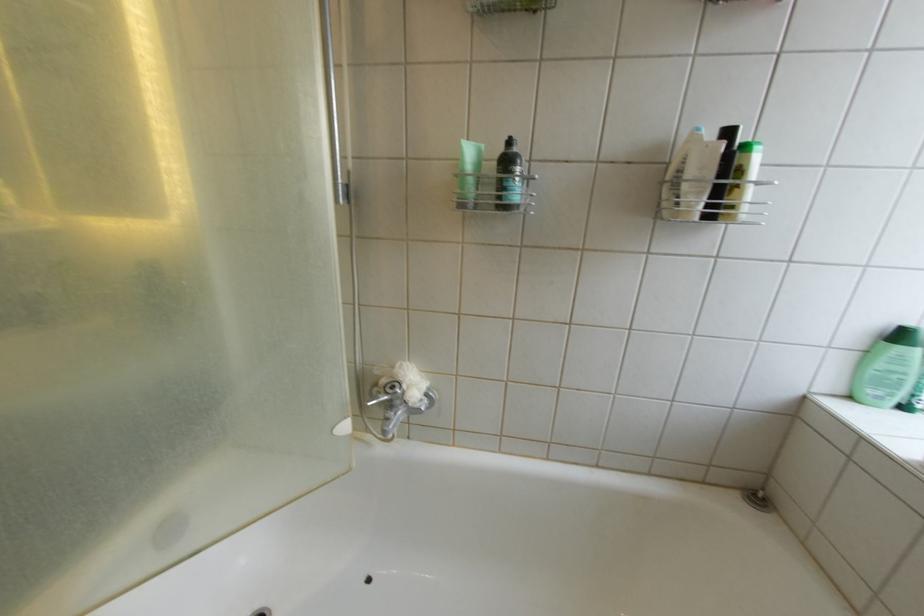
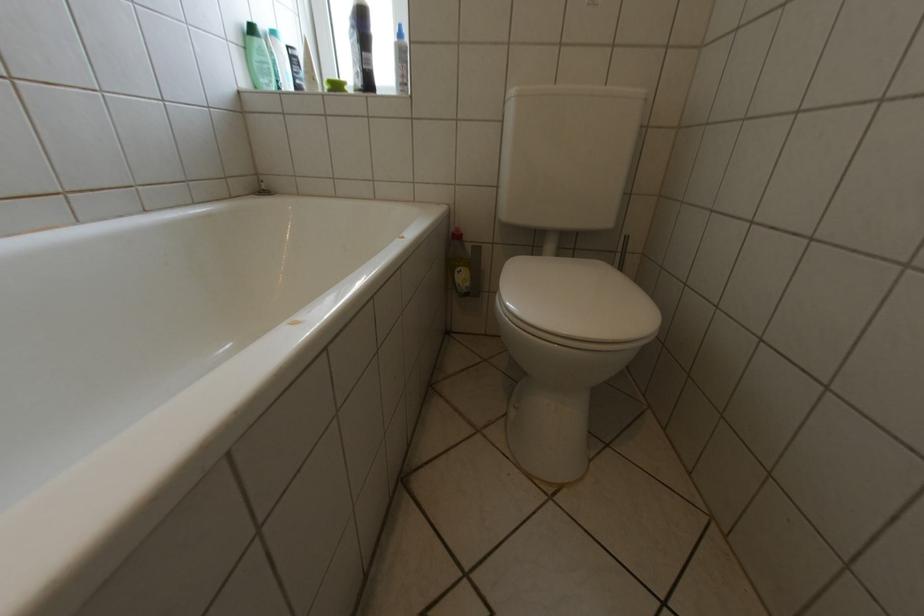
Looking at this image, the images are taken continuously from a first-person perspective. In which direction is your viewpoint rotating?

The camera rotated toward right-down.